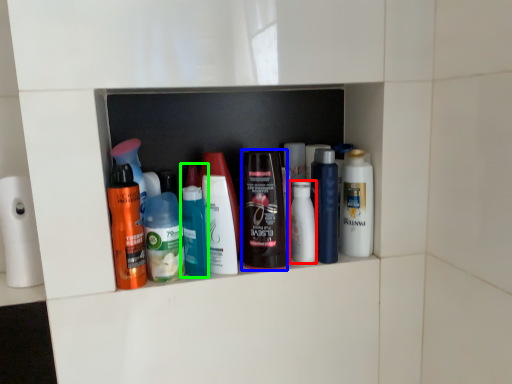
Question: Which object is positioned closest to toiletry (highlighted by a red box)? Select from toiletry (highlighted by a blue box) and toiletry (highlighted by a green box).

Choices:
 (A) toiletry
 (B) toiletry

Answer: (A)